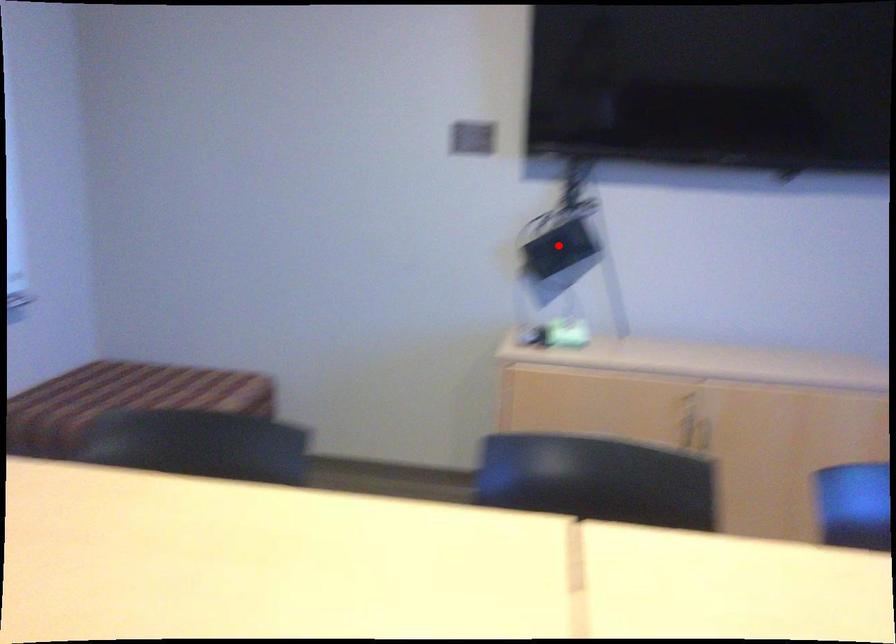
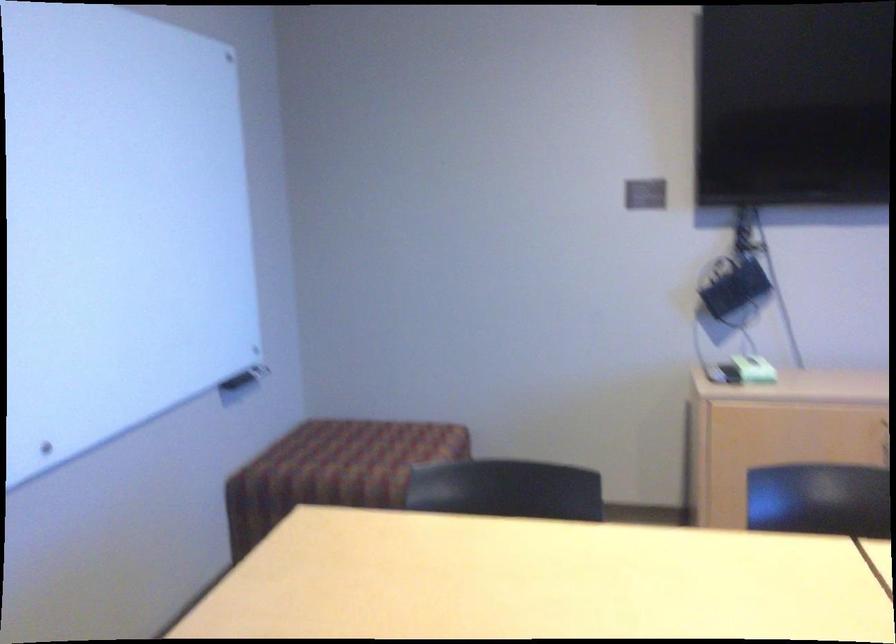
Find the pixel in the second image that matches the highlighted location in the first image.

(734, 289)